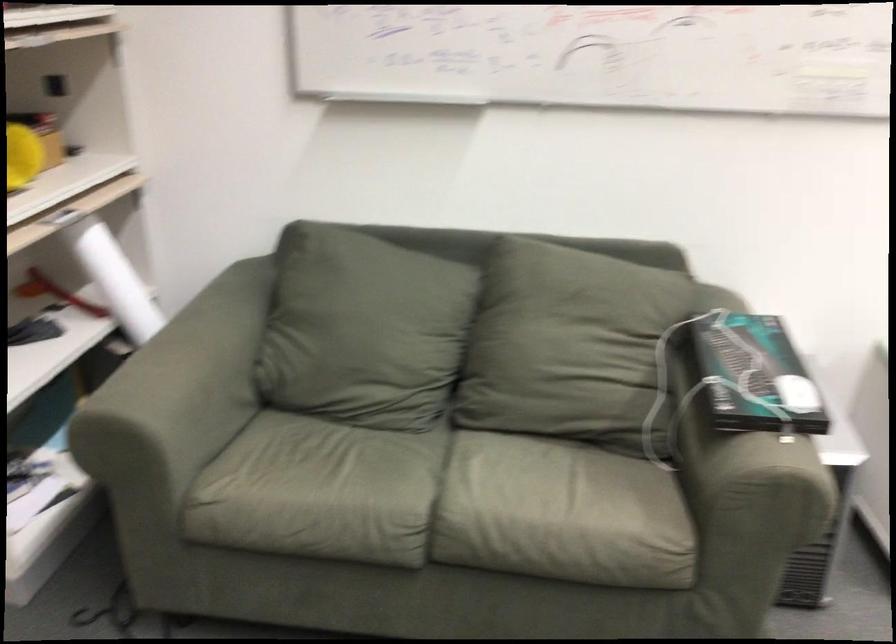
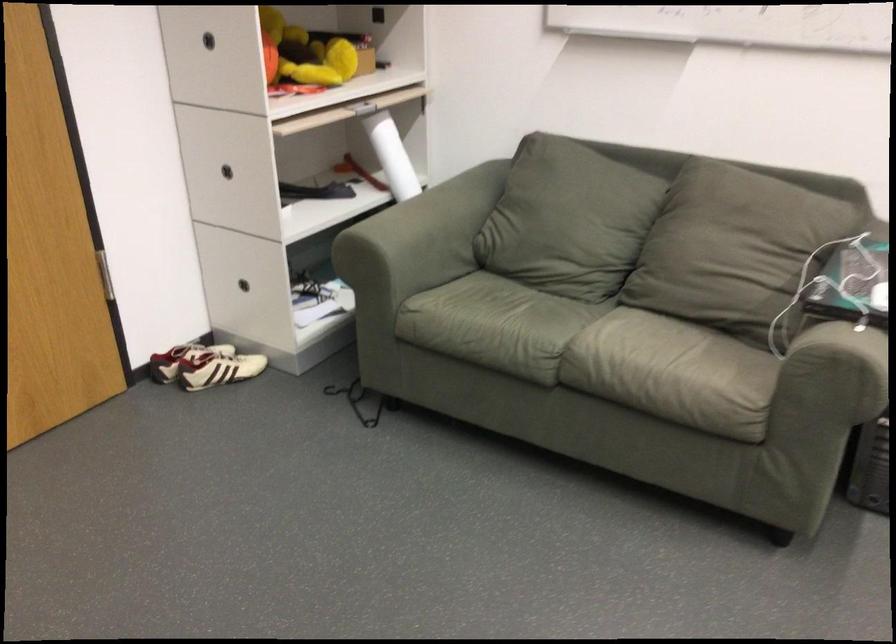
Which direction would the cameraman need to move to produce the second image?

The cameraman moved toward right, backward.